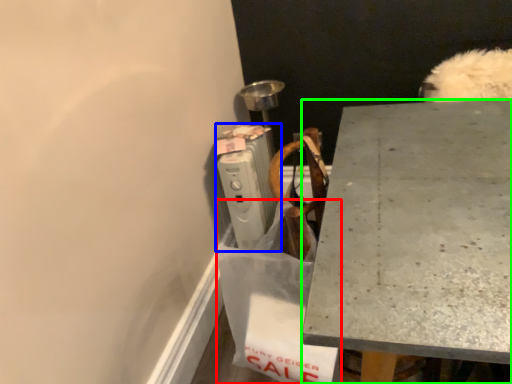
Question: Which object is positioned closest to shopping bag (highlighted by a red box)? Select from radiator (highlighted by a blue box) and desk (highlighted by a green box).

Choices:
 (A) radiator
 (B) desk

Answer: (B)